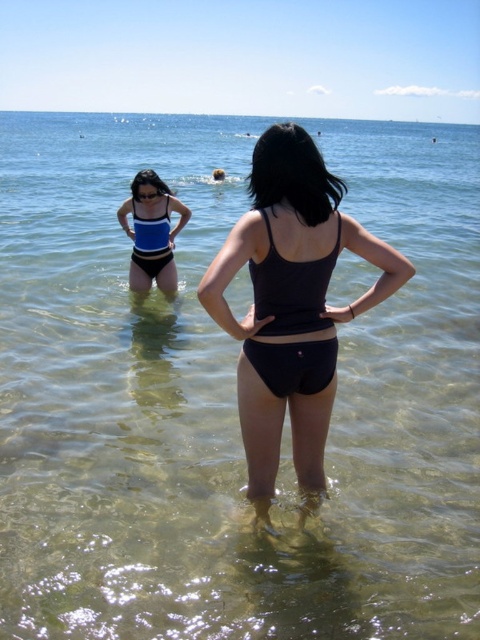
Can you confirm if blue matte swimsuit at upper left is shorter than blue matte bikini at upper center?

No.

Between point (165, 200) and point (134, 227), which one is positioned in front?

Point (165, 200) is in front.

Between point (139, 243) and point (163, 259), which one is positioned in front?

Point (139, 243)

Locate an element on the screen. This screenshot has width=480, height=640. blue matte swimsuit at upper left is located at coordinates (152, 232).

Which is below, black matte bikini at center or blue matte swimsuit at upper left?

black matte bikini at center is below.

Who is positioned more to the right, black matte bikini at center or blue matte swimsuit at upper left?

From the viewer's perspective, black matte bikini at center appears more on the right side.

Where is `black matte bikini at center`? The image size is (480, 640). black matte bikini at center is located at coordinates (291, 289).

Is black matte bikini at center above blue matte bikini at upper center?

No.

Is black matte bikini at center to the right of blue matte bikini at upper center from the viewer's perspective?

Correct, you'll find black matte bikini at center to the right of blue matte bikini at upper center.

Where is `black matte bikini at center`? This screenshot has height=640, width=480. black matte bikini at center is located at coordinates (291, 289).

Identify the location of black matte bikini at center. Image resolution: width=480 pixels, height=640 pixels. (291, 289).